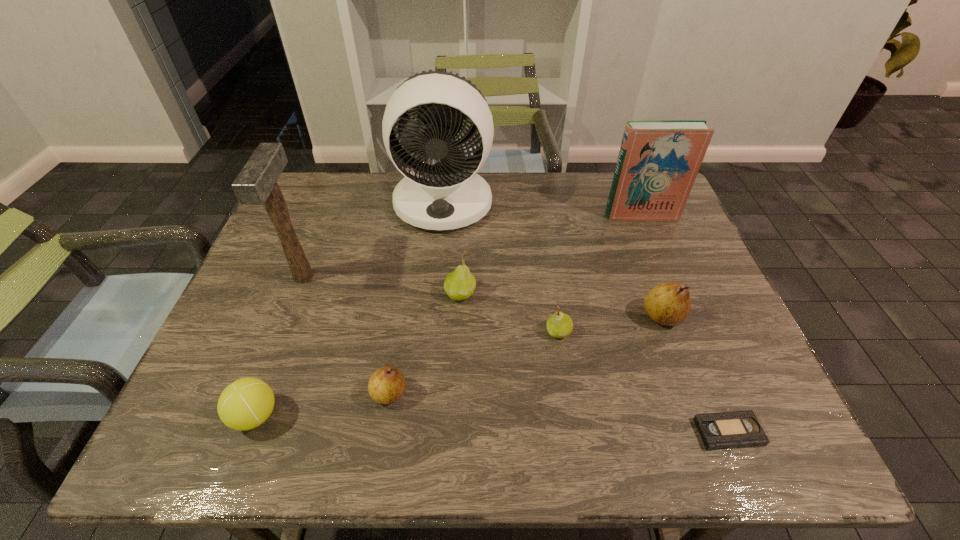
What are the coordinates of `vacant space that's between the mallet and the green tennis ball` in the screenshot? It's located at (279, 346).

What are the coordinates of `unoccupied position between the third pear from right to left and the gray fan` in the screenshot? It's located at (452, 248).

Find the location of a particular element. empty location between the second pear from left to right and the videotape is located at coordinates (594, 363).

Where is `unoccupied area between the videotape and the mallet`? This screenshot has width=960, height=540. unoccupied area between the videotape and the mallet is located at coordinates (516, 354).

I want to click on vacant area between the mallet and the nearest pear, so click(347, 335).

The height and width of the screenshot is (540, 960). In order to click on empty space that is in between the seventh shortest object and the tennis ball in this screenshot , I will do `click(448, 315)`.

I want to click on vacant space that's between the mallet and the third pear from right to left, so click(382, 285).

Identify the location of vacant area that lies between the sixth object from left to right and the videotape. (643, 382).

Where is `empty location between the green tennis ball and the videotape`? empty location between the green tennis ball and the videotape is located at coordinates (492, 424).

Point out which object is positioned as the nearest to the shortest object. Please provide its 2D coordinates. Your answer should be formatted as a tuple, i.e. [(x, y)], where the tuple contains the x and y coordinates of a point satisfying the conditions above.

[(669, 304)]